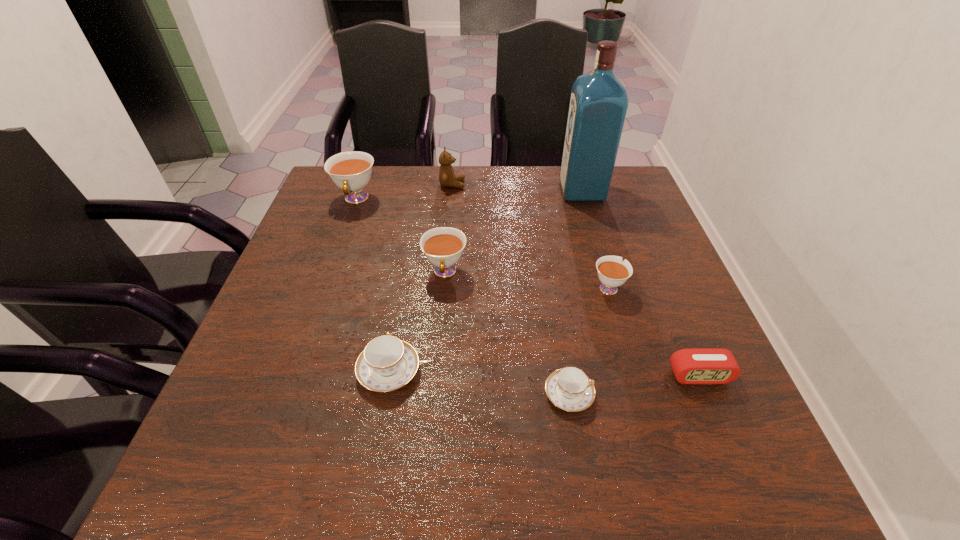
Locate an element on the screen. This screenshot has height=540, width=960. blue liquor is located at coordinates (598, 104).

At what (x,y) coordinates should I click in order to perform the action: click on the tallest object. Please return your answer as a coordinate pair (x, y). Image resolution: width=960 pixels, height=540 pixels. Looking at the image, I should click on (598, 104).

Find the location of a particular element. This screenshot has height=540, width=960. teddy bear is located at coordinates (447, 178).

Locate an element on the screen. The height and width of the screenshot is (540, 960). the farthest teacup is located at coordinates (351, 171).

The width and height of the screenshot is (960, 540). I want to click on the leftmost object, so click(x=351, y=171).

Where is `the fifth shortest object`? The image size is (960, 540). the fifth shortest object is located at coordinates (443, 246).

Image resolution: width=960 pixels, height=540 pixels. I want to click on the second white teacup from left to right, so click(x=443, y=246).

Identify the location of the smallest white teacup. The image size is (960, 540). (612, 272).

Identify the location of the rightmost white teacup. This screenshot has width=960, height=540. (612, 272).

At what (x,y) coordinates should I click in order to perform the action: click on the bigger blue teacup. Please return your answer as a coordinate pair (x, y). The height and width of the screenshot is (540, 960). Looking at the image, I should click on (387, 363).